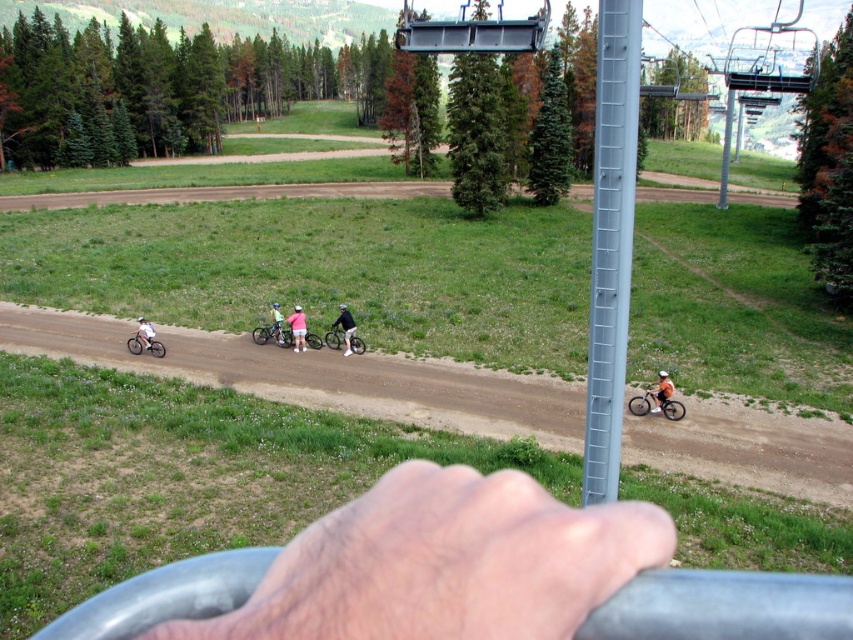
You are a photographer standing in the ski resort area. You want to take a photo of the shiny metallic bicycle at center and the white matte helmet at center. Which object should you focus on first if you want to capture both in the same frame without moving the camera?

The shiny metallic bicycle at center is positioned under the white matte helmet at center, so you should focus on the white matte helmet at center first to ensure both are in focus since it is closer to the camera.